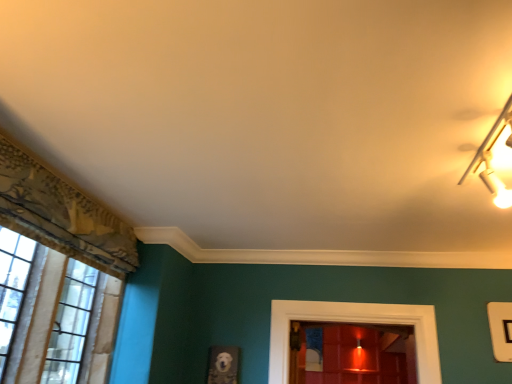
Identify the location of metallic gold light fixture at upper right. (490, 160).

What do you see at coordinates (490, 160) in the screenshot?
I see `metallic gold light fixture at upper right` at bounding box center [490, 160].

The image size is (512, 384). What do you see at coordinates (53, 315) in the screenshot?
I see `white textured curtain at left` at bounding box center [53, 315].

What are the coordinates of `white textured curtain at left` in the screenshot? It's located at (53, 315).

At what (x,y) coordinates should I click in order to perform the action: click on metallic gold light fixture at upper right. Please return your answer as a coordinate pair (x, y). This screenshot has width=512, height=384. Looking at the image, I should click on (490, 160).

Considering the relative positions of white textured curtain at left and metallic gold light fixture at upper right in the image provided, is white textured curtain at left to the left of metallic gold light fixture at upper right from the viewer's perspective?

Correct, you'll find white textured curtain at left to the left of metallic gold light fixture at upper right.

Which is behind, white textured curtain at left or metallic gold light fixture at upper right?

white textured curtain at left.

Considering the positions of point (89, 358) and point (495, 198), is point (89, 358) closer or farther from the camera than point (495, 198)?

Point (89, 358) appears to be farther away from the viewer than point (495, 198).

From the image's perspective, which is above, white textured curtain at left or metallic gold light fixture at upper right?

metallic gold light fixture at upper right is shown above in the image.

Consider the image. From a real-world perspective, which object rests below the other?

white textured curtain at left.

Considering the relative sizes of white textured curtain at left and metallic gold light fixture at upper right in the image provided, is white textured curtain at left wider than metallic gold light fixture at upper right?

No, white textured curtain at left is not wider than metallic gold light fixture at upper right.

Who is taller, white textured curtain at left or metallic gold light fixture at upper right?

white textured curtain at left is taller.

Considering the sizes of objects white textured curtain at left and metallic gold light fixture at upper right in the image provided, who is smaller, white textured curtain at left or metallic gold light fixture at upper right?

With smaller size is metallic gold light fixture at upper right.

Is metallic gold light fixture at upper right inside white textured curtain at left?

Actually, metallic gold light fixture at upper right is outside white textured curtain at left.

Would you consider white textured curtain at left to be distant from metallic gold light fixture at upper right?

Yes, white textured curtain at left and metallic gold light fixture at upper right are quite far apart.

Is metallic gold light fixture at upper right at the back of white textured curtain at left?

That's not correct — white textured curtain at left is not looking away from metallic gold light fixture at upper right.

Where is `lamp located above the white textured curtain at left (from a real-world perspective)`? lamp located above the white textured curtain at left (from a real-world perspective) is located at coordinates (490, 160).

Is metallic gold light fixture at upper right to the left or to the right of white textured curtain at left in the image?

metallic gold light fixture at upper right is to the right of white textured curtain at left.

Is metallic gold light fixture at upper right positioned before white textured curtain at left?

Yes, the depth of metallic gold light fixture at upper right is less than that of white textured curtain at left.

Considering the points (505, 106) and (25, 351), which point is behind, point (505, 106) or point (25, 351)?

The point (25, 351) is farther from the camera.

From the image's perspective, is metallic gold light fixture at upper right on white textured curtain at left?

Yes.

From a real-world perspective, is metallic gold light fixture at upper right positioned over white textured curtain at left based on gravity?

Yes.

Considering the relative sizes of metallic gold light fixture at upper right and white textured curtain at left in the image provided, is metallic gold light fixture at upper right wider than white textured curtain at left?

Correct, the width of metallic gold light fixture at upper right exceeds that of white textured curtain at left.

Who is taller, metallic gold light fixture at upper right or white textured curtain at left?

With more height is white textured curtain at left.

Does metallic gold light fixture at upper right have a smaller size compared to white textured curtain at left?

Yes, metallic gold light fixture at upper right is smaller than white textured curtain at left.

Can white textured curtain at left be found inside metallic gold light fixture at upper right?

No, white textured curtain at left is not inside metallic gold light fixture at upper right.

Is the surface of metallic gold light fixture at upper right in direct contact with white textured curtain at left?

No, metallic gold light fixture at upper right is not touching white textured curtain at left.

Does metallic gold light fixture at upper right turn towards white textured curtain at left?

No, metallic gold light fixture at upper right does not turn towards white textured curtain at left.

How many degrees apart are the facing directions of metallic gold light fixture at upper right and white textured curtain at left?

89 degrees.

Find the location of a particular element. Image resolution: width=512 pixels, height=384 pixels. lamp that is on the right side of white textured curtain at left is located at coordinates (490, 160).

The height and width of the screenshot is (384, 512). Identify the location of lamp above the white textured curtain at left (from the image's perspective). (490, 160).

At what (x,y) coordinates should I click in order to perform the action: click on lamp to the right of white textured curtain at left. Please return your answer as a coordinate pair (x, y). Looking at the image, I should click on (490, 160).